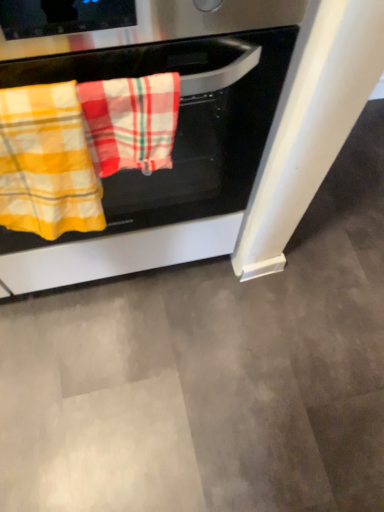
Identify the location of yellow plaid towel at left, positioned as the 1th beach towel in left-to-right order. This screenshot has width=384, height=512. (46, 163).

Find the location of a particular element. The width and height of the screenshot is (384, 512). stainless steel oven at center is located at coordinates (177, 129).

Can you tell me how much yellow plaid towel at left, which ranks as the 2th beach towel in right-to-left order, and stainless steel oven at center differ in facing direction?

The facing directions of yellow plaid towel at left, which ranks as the 2th beach towel in right-to-left order, and stainless steel oven at center are 0.106 degrees apart.

From a real-world perspective, between yellow plaid towel at left, which ranks as the 2th beach towel in right-to-left order, and stainless steel oven at center, who is vertically lower?

stainless steel oven at center, from a real-world perspective.

Does yellow plaid towel at left, which ranks as the 2th beach towel in right-to-left order, appear on the left side of stainless steel oven at center?

Yes.

Could you tell me if yellow plaid towel at left, which ranks as the 2th beach towel in right-to-left order, is turned towards stainless steel oven at center?

No, yellow plaid towel at left, which ranks as the 2th beach towel in right-to-left order, is not aimed at stainless steel oven at center.

Looking at this image, considering the relative positions of stainless steel oven at center and plaid cotton beach towel at center, acting as the 1th beach towel starting from the right, in the image provided, is stainless steel oven at center in front of plaid cotton beach towel at center, acting as the 1th beach towel starting from the right,?

Yes, stainless steel oven at center is closer to the camera.

Identify the location of beach towel that appears on the right of stainless steel oven at center. (130, 122).

Is stainless steel oven at center completely or partially outside of plaid cotton beach towel at center, the second beach towel viewed from the left?

Yes, stainless steel oven at center is not within plaid cotton beach towel at center, the second beach towel viewed from the left.

Consider the image. Considering the relative positions of stainless steel oven at center and yellow plaid towel at left, which ranks as the 2th beach towel in right-to-left order, in the image provided, is stainless steel oven at center to the right of yellow plaid towel at left, which ranks as the 2th beach towel in right-to-left order, from the viewer's perspective?

Yes.

Considering the positions of objects stainless steel oven at center and yellow plaid towel at left, positioned as the 1th beach towel in left-to-right order, in the image provided, who is behind, stainless steel oven at center or yellow plaid towel at left, positioned as the 1th beach towel in left-to-right order,?

yellow plaid towel at left, positioned as the 1th beach towel in left-to-right order, is further away from the camera.

Is stainless steel oven at center in contact with yellow plaid towel at left, which ranks as the 2th beach towel in right-to-left order?

stainless steel oven at center and yellow plaid towel at left, which ranks as the 2th beach towel in right-to-left order, are not in contact.

Which is behind, point (83, 19) or point (11, 105)?

The point (11, 105) is farther.

Considering the sizes of plaid cotton beach towel at center, acting as the 1th beach towel starting from the right, and stainless steel oven at center in the image, is plaid cotton beach towel at center, acting as the 1th beach towel starting from the right, bigger or smaller than stainless steel oven at center?

plaid cotton beach towel at center, acting as the 1th beach towel starting from the right, is smaller than stainless steel oven at center.

Which object is positioned more to the left, plaid cotton beach towel at center, the second beach towel viewed from the left, or stainless steel oven at center?

stainless steel oven at center is more to the left.

What's the angular difference between plaid cotton beach towel at center, acting as the 1th beach towel starting from the right, and stainless steel oven at center's facing directions?

They differ by 0.106 degrees in their facing directions.

From a real-world perspective, who is located higher, plaid cotton beach towel at center, the second beach towel viewed from the left, or stainless steel oven at center?

plaid cotton beach towel at center, the second beach towel viewed from the left.

Is yellow plaid towel at left, positioned as the 1th beach towel in left-to-right order, oriented away from plaid cotton beach towel at center, acting as the 1th beach towel starting from the right?

No, plaid cotton beach towel at center, acting as the 1th beach towel starting from the right, is not at the back of yellow plaid towel at left, positioned as the 1th beach towel in left-to-right order.

Is yellow plaid towel at left, which ranks as the 2th beach towel in right-to-left order, bigger or smaller than plaid cotton beach towel at center, the second beach towel viewed from the left?

Considering their sizes, yellow plaid towel at left, which ranks as the 2th beach towel in right-to-left order, takes up more space than plaid cotton beach towel at center, the second beach towel viewed from the left.

Which is closer, (81,204) or (141,123)?

Point (81,204).

Is point (167, 116) closer or farther from the camera than point (29, 106)?

Clearly, point (167, 116) is more distant from the camera than point (29, 106).

Is plaid cotton beach towel at center, acting as the 1th beach towel starting from the right, beside yellow plaid towel at left, which ranks as the 2th beach towel in right-to-left order?

Yes.

Looking at this image, which of these two, plaid cotton beach towel at center, acting as the 1th beach towel starting from the right, or yellow plaid towel at left, which ranks as the 2th beach towel in right-to-left order, is wider?

yellow plaid towel at left, which ranks as the 2th beach towel in right-to-left order, is wider.

The width and height of the screenshot is (384, 512). Identify the location of oven on the right of yellow plaid towel at left, positioned as the 1th beach towel in left-to-right order. (177, 129).

Locate an element on the screen. Image resolution: width=384 pixels, height=512 pixels. oven below the plaid cotton beach towel at center, the second beach towel viewed from the left (from a real-world perspective) is located at coordinates (177, 129).

Looking at the image, which one is located closer to yellow plaid towel at left, positioned as the 1th beach towel in left-to-right order, plaid cotton beach towel at center, acting as the 1th beach towel starting from the right, or stainless steel oven at center?

plaid cotton beach towel at center, acting as the 1th beach towel starting from the right, lies closer to yellow plaid towel at left, positioned as the 1th beach towel in left-to-right order, than the other object.

Based on their spatial positions, is plaid cotton beach towel at center, acting as the 1th beach towel starting from the right, or yellow plaid towel at left, positioned as the 1th beach towel in left-to-right order, closer to stainless steel oven at center?

plaid cotton beach towel at center, acting as the 1th beach towel starting from the right.

Based on their spatial positions, is yellow plaid towel at left, which ranks as the 2th beach towel in right-to-left order, or plaid cotton beach towel at center, the second beach towel viewed from the left, closer to stainless steel oven at center?

The object closer to stainless steel oven at center is plaid cotton beach towel at center, the second beach towel viewed from the left.

Based on their spatial positions, is stainless steel oven at center or yellow plaid towel at left, positioned as the 1th beach towel in left-to-right order, further from plaid cotton beach towel at center, the second beach towel viewed from the left?

stainless steel oven at center is further to plaid cotton beach towel at center, the second beach towel viewed from the left.

When comparing their distances from yellow plaid towel at left, positioned as the 1th beach towel in left-to-right order, does stainless steel oven at center or plaid cotton beach towel at center, acting as the 1th beach towel starting from the right, seem further?

stainless steel oven at center.

From the image, which object appears to be farther from plaid cotton beach towel at center, acting as the 1th beach towel starting from the right, yellow plaid towel at left, positioned as the 1th beach towel in left-to-right order, or stainless steel oven at center?

The object further to plaid cotton beach towel at center, acting as the 1th beach towel starting from the right, is stainless steel oven at center.

At what (x,y) coordinates should I click in order to perform the action: click on beach towel between stainless steel oven at center and yellow plaid towel at left, which ranks as the 2th beach towel in right-to-left order, from top to bottom. Please return your answer as a coordinate pair (x, y). The image size is (384, 512). Looking at the image, I should click on (130, 122).